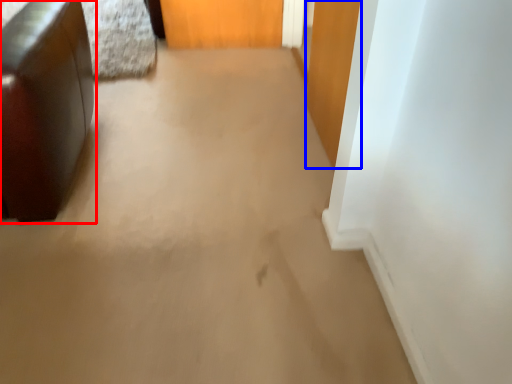
Question: Which point is further to the camera, furniture (highlighted by a red box) or door (highlighted by a blue box)?

Choices:
 (A) furniture
 (B) door

Answer: (B)